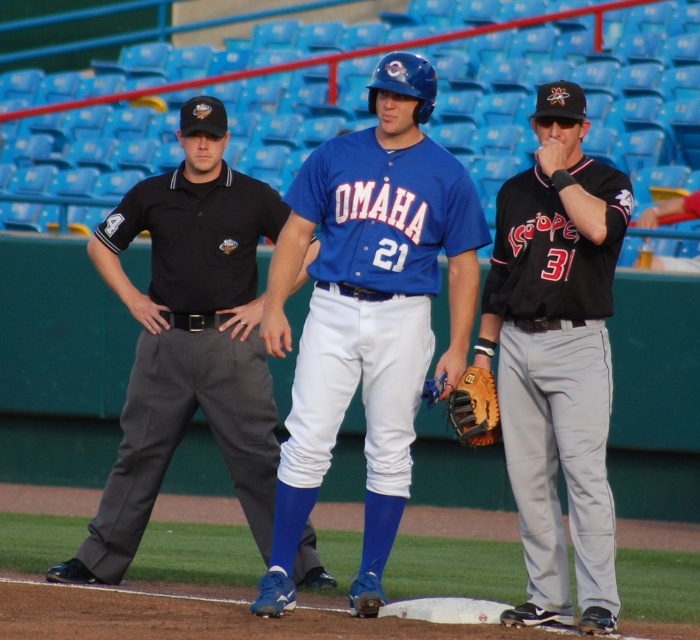
You are a baseball player who just caught a fly ball and need to tag a runner out. You see the black jersey at center and the brown leather baseball glove at center. If you can throw the ball 18 inches, will you be able to reach the umpire in time to make the tag?

The black jersey at center is 18.34 inches from the brown leather baseball glove at center. Since you can throw the ball 18 inches, you won

Where is the blue matte baseball uniform at center located in the image?

The blue matte baseball uniform at center is located at point coordinates of approximately 0.489 on the x axis and 0.527 on the y axis.

You are a photographer at the baseball game and want to capture a photo of the blue matte baseball uniform at center and the black jersey at center. Which one is positioned higher in the frame?

The blue matte baseball uniform at center is located above the black jersey at center, so it is positioned higher in the frame.